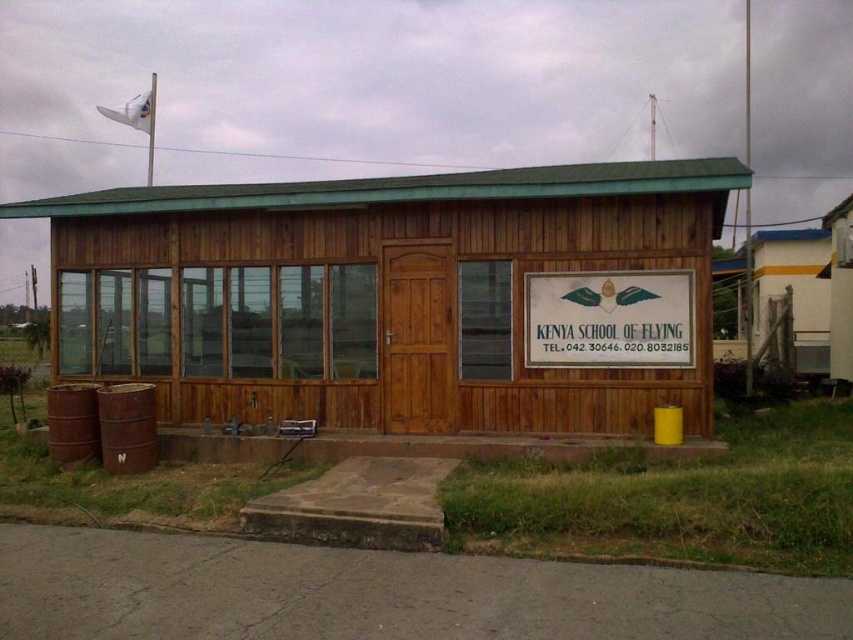
Question: In this image, where is wooden hut at center located relative to white wooden sign at center?

Choices:
 (A) right
 (B) left

Answer: (B)

Question: Is wooden hut at center closer to the viewer compared to white wooden sign at center?

Choices:
 (A) no
 (B) yes

Answer: (B)

Question: Is wooden hut at center to the left of white wooden sign at center from the viewer's perspective?

Choices:
 (A) no
 (B) yes

Answer: (B)